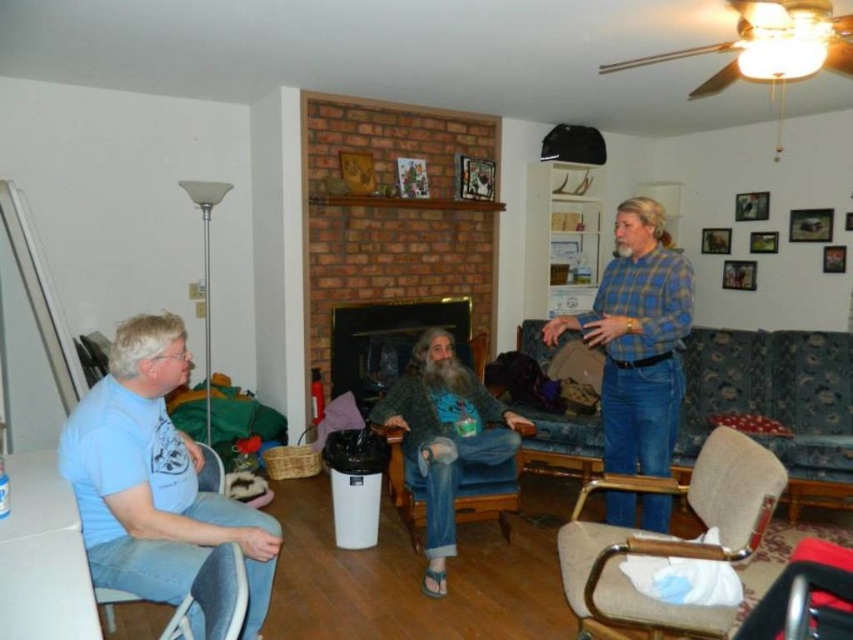
Does light blue t-shirt at left have a greater height compared to beige fabric chair at lower right?

Yes.

Does light blue t-shirt at left have a lesser width compared to beige fabric chair at lower right?

In fact, light blue t-shirt at left might be wider than beige fabric chair at lower right.

Does point (103, 508) come behind point (656, 480)?

No, it is not.

Image resolution: width=853 pixels, height=640 pixels. Identify the location of light blue t-shirt at left. (154, 480).

Which is more to the right, blue plaid shirt at right or beige fabric chair at lower right?

From the viewer's perspective, blue plaid shirt at right appears more on the right side.

Can you confirm if blue plaid shirt at right is shorter than beige fabric chair at lower right?

No, blue plaid shirt at right is not shorter than beige fabric chair at lower right.

Between point (631, 326) and point (712, 520), which one is positioned behind?

The point (631, 326) is more distant.

Where is `blue plaid shirt at right`? The width and height of the screenshot is (853, 640). blue plaid shirt at right is located at coordinates (637, 340).

Image resolution: width=853 pixels, height=640 pixels. What do you see at coordinates (670, 541) in the screenshot?
I see `beige fabric chair at lower right` at bounding box center [670, 541].

Does beige fabric chair at lower right appear under denim fabric armchair at left?

Indeed, beige fabric chair at lower right is positioned under denim fabric armchair at left.

Identify the location of beige fabric chair at lower right. (670, 541).

This screenshot has width=853, height=640. I want to click on beige fabric chair at lower right, so click(x=670, y=541).